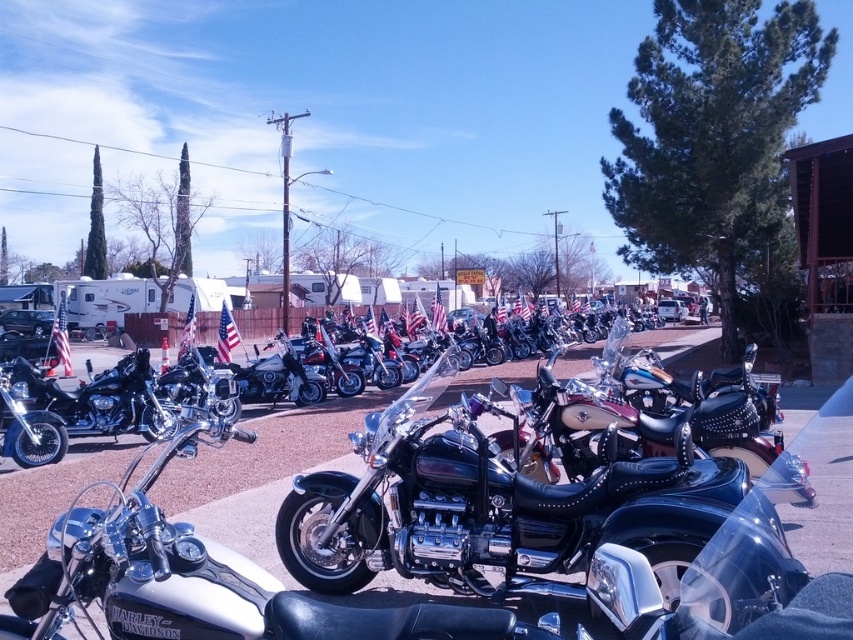
Does polished chrome cruiser at center appear on the left side of polished chrome motorcycle at center?

Correct, you'll find polished chrome cruiser at center to the left of polished chrome motorcycle at center.

Can you confirm if polished chrome cruiser at center is positioned to the right of polished chrome motorcycle at center?

In fact, polished chrome cruiser at center is to the left of polished chrome motorcycle at center.

Between point (312, 499) and point (668, 433), which one is positioned in front?

Point (312, 499) is in front.

You are a GUI agent. You are given a task and a screenshot of the screen. Output one action in this format:
    pyautogui.click(x=<x>, y=<y>)
    Task: Click on the polished chrome cruiser at center
    
    Given the screenshot: What is the action you would take?
    pyautogui.click(x=497, y=509)